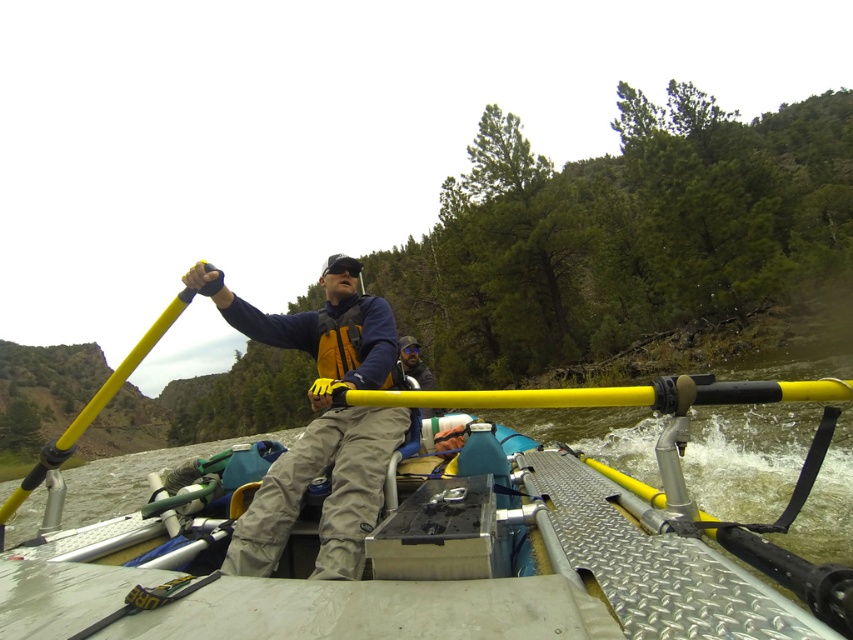
Question: Is metallic diamond plate boat at center to the right of matte yellow paddle at upper left from the viewer's perspective?

Choices:
 (A) no
 (B) yes

Answer: (B)

Question: Where is metallic diamond plate boat at center located in relation to matte yellow paddle at upper left in the image?

Choices:
 (A) below
 (B) above

Answer: (A)

Question: Considering the real-world distances, which object is farthest from the metallic diamond plate boat at center?

Choices:
 (A) matte yellow paddle at upper left
 (B) yellow plastic paddle at upper center

Answer: (B)

Question: Which of these objects is positioned closest to the matte yellow paddle at upper left?

Choices:
 (A) metallic diamond plate boat at center
 (B) yellow plastic paddle at upper center
 (C) yellow rubber paddle at center

Answer: (C)

Question: Among these objects, which one is nearest to the camera?

Choices:
 (A) matte yellow paddle at upper left
 (B) yellow rubber paddle at center
 (C) metallic diamond plate boat at center

Answer: (C)

Question: Does matte yellow paddle at upper left have a lesser width compared to yellow rubber paddle at center?

Choices:
 (A) yes
 (B) no

Answer: (B)